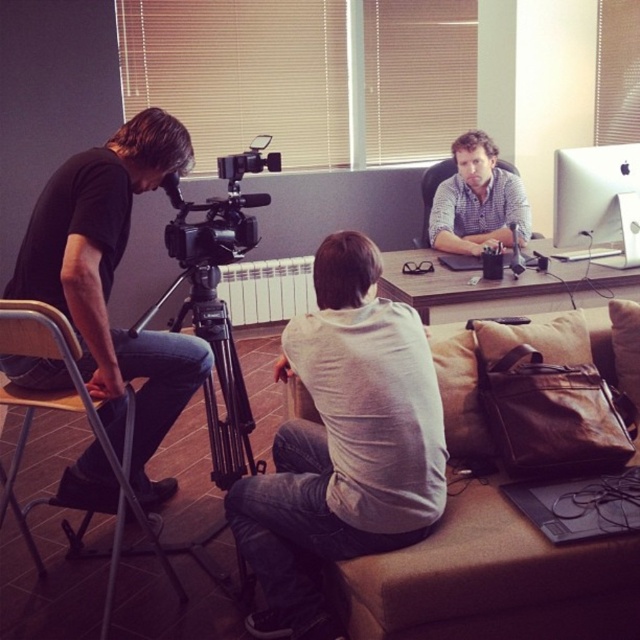
You are a photographer who needs to adjust the distance between the black matte camera at left and the brown fabric couch at lower right to ensure proper framing. Currently, they are 3.42 feet apart. If your ideal distance is 4 feet, should you move the camera closer to or farther from the couch?

The black matte camera at left and brown fabric couch at lower right are currently 3.42 feet apart. To reach the ideal distance of 4 feet, you should move the camera farther from the couch.

You are setting up a narrow shelf to place both the black matte camera at left and the wooden desk at center. Which object should you place first to ensure they both fit on the shelf?

The black matte camera at left is thinner than the wooden desk at center, so you should place the wooden desk at center first to accommodate its larger width before placing the black matte camera at left.